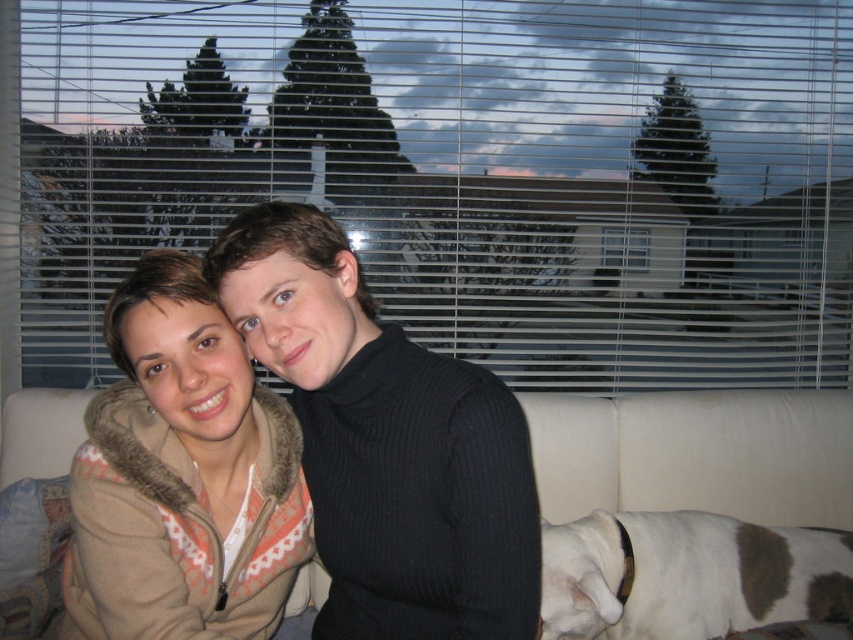
You are trying to determine if the transparent plastic blinds at upper center can cover the entire height of the camouflage fleece jacket at center. Based on the scene, can they?

The transparent plastic blinds at upper center have a greater height than the camouflage fleece jacket at center, so they can cover its entire height.